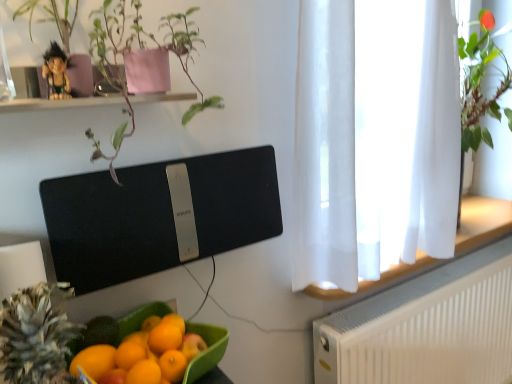
What do you see at coordinates (141, 61) in the screenshot? The height and width of the screenshot is (384, 512). I see `green matte plant at upper left` at bounding box center [141, 61].

What is the approximate width of green matte plant at upper left?

green matte plant at upper left is 9.92 inches wide.

Describe the element at coordinates (159, 215) in the screenshot. I see `black matte speaker at upper center` at that location.

This screenshot has height=384, width=512. In order to click on white sheer curtain at right in this screenshot , I will do `click(374, 138)`.

Describe the element at coordinates (374, 138) in the screenshot. I see `white sheer curtain at right` at that location.

Measure the distance between white textured radiator at lower right and camera.

white textured radiator at lower right is 3.74 feet away from camera.

Measure the distance between point (53,319) and camera.

51.60 centimeters.

What do you see at coordinates (56, 72) in the screenshot?
I see `plastic figurine at upper left` at bounding box center [56, 72].

At what (x,y) coordinates should I click in order to perform the action: click on green matte plant at upper left. Please return your answer as a coordinate pair (x, y). The image size is (512, 384). Looking at the image, I should click on (141, 61).

Could you tell me if white sheer curtain at right is turned towards white textured radiator at lower right?

No, white sheer curtain at right is not oriented towards white textured radiator at lower right.

In the image, is white sheer curtain at right on the left side or the right side of white textured radiator at lower right?

white sheer curtain at right is to the left of white textured radiator at lower right.

The height and width of the screenshot is (384, 512). What are the coordinates of `radiator below the white sheer curtain at right (from the image's perspective)` in the screenshot? It's located at (426, 327).

Does point (326, 236) come in front of point (413, 334)?

Yes, point (326, 236) is in front of point (413, 334).

Is black matte speaker at upper center to the left of green matte plant at upper left from the viewer's perspective?

In fact, black matte speaker at upper center is to the right of green matte plant at upper left.

From a real-world perspective, relative to green matte plant at upper left, is black matte speaker at upper center vertically above or below?

black matte speaker at upper center is situated lower than green matte plant at upper left in the real world.

Based on the photo, would you say black matte speaker at upper center is a long distance from green matte plant at upper left?

No, there isn't a large distance between black matte speaker at upper center and green matte plant at upper left.

Are green textured pineapple at lower left and white sheer curtain at right located far from each other?

No, there isn't a large distance between green textured pineapple at lower left and white sheer curtain at right.

Is green textured pineapple at lower left looking in the opposite direction of white sheer curtain at right?

No, white sheer curtain at right is not at the back of green textured pineapple at lower left.

From the image's perspective, which object appears higher, green textured pineapple at lower left or white sheer curtain at right?

From the image's view, white sheer curtain at right is above.

Is green textured pineapple at lower left wider or thinner than white sheer curtain at right?

Considering their sizes, green textured pineapple at lower left looks slimmer than white sheer curtain at right.

Is white textured radiator at lower right located within black matte speaker at upper center?

No, white textured radiator at lower right is not a part of black matte speaker at upper center.

Does black matte speaker at upper center have a larger size compared to white textured radiator at lower right?

No, black matte speaker at upper center is not bigger than white textured radiator at lower right.

Does point (97, 173) lie behind point (478, 325)?

No.

Which of these two, black matte speaker at upper center or white textured radiator at lower right, stands shorter?

Standing shorter between the two is black matte speaker at upper center.

Is black matte speaker at upper center touching green textured pineapple at lower left?

No, black matte speaker at upper center is not next to green textured pineapple at lower left.

Considering the positions of objects black matte speaker at upper center and green textured pineapple at lower left in the image provided, who is more to the left, black matte speaker at upper center or green textured pineapple at lower left?

green textured pineapple at lower left is more to the left.

Consider the image. Considering the sizes of objects black matte speaker at upper center and green textured pineapple at lower left in the image provided, who is bigger, black matte speaker at upper center or green textured pineapple at lower left?

Bigger between the two is black matte speaker at upper center.

Considering the positions of objects plastic figurine at upper left and white sheer curtain at right in the image provided, who is behind, plastic figurine at upper left or white sheer curtain at right?

white sheer curtain at right is behind.

Based on the photo, which is closer to the camera, (67, 98) or (324, 191)?

The point (67, 98) is closer to the camera.

From the picture: Can you confirm if plastic figurine at upper left is thinner than white sheer curtain at right?

Yes.

Find the location of a particular element. window frame behind the plastic figurine at upper left is located at coordinates (374, 138).

Is green textured pineapple at lower left bigger than black matte speaker at upper center?

No.

Is green textured pineapple at lower left positioned behind black matte speaker at upper center?

No, the depth of green textured pineapple at lower left is less than that of black matte speaker at upper center.

Considering the points (64, 374) and (234, 197), which point is behind, point (64, 374) or point (234, 197)?

The point (234, 197) is more distant.

Is there a large distance between green textured pineapple at lower left and black matte speaker at upper center?

No.

In the image, there is a white sheer curtain at right. Where is `radiator below it (from a real-world perspective)`? This screenshot has height=384, width=512. radiator below it (from a real-world perspective) is located at coordinates (426, 327).

Identify the location of computer monitor below the green matte plant at upper left (from the image's perspective). Image resolution: width=512 pixels, height=384 pixels. (159, 215).

From the image, which object appears to be nearer to black matte speaker at upper center, green matte plant at upper left or plastic figurine at upper left?

green matte plant at upper left is closer to black matte speaker at upper center.

Which object lies nearer to the anchor point white sheer curtain at right, plastic figurine at upper left or black matte speaker at upper center?

black matte speaker at upper center is closer to white sheer curtain at right.

Which object lies further to the anchor point white sheer curtain at right, green matte plant at upper left or black matte speaker at upper center?

green matte plant at upper left is positioned further to the anchor white sheer curtain at right.

Considering their positions, is plastic figurine at upper left positioned closer to black matte speaker at upper center than green matte plant at upper left?

green matte plant at upper left.

From the image, which object appears to be farther from green matte plant at upper left, plastic figurine at upper left or white textured radiator at lower right?

white textured radiator at lower right is further to green matte plant at upper left.

When comparing their distances from plastic figurine at upper left, does white textured radiator at lower right or green textured pineapple at lower left seem further?

white textured radiator at lower right lies further to plastic figurine at upper left than the other object.

When comparing their distances from green textured pineapple at lower left, does black matte speaker at upper center or green matte plant at upper left seem closer?

The object closer to green textured pineapple at lower left is black matte speaker at upper center.

Looking at the image, which one is located further to green matte plant at upper left, black matte speaker at upper center or plastic figurine at upper left?

black matte speaker at upper center lies further to green matte plant at upper left than the other object.

Locate an element on the screen. window frame between black matte speaker at upper center and white textured radiator at lower right from left to right is located at coordinates (374, 138).

Identify the location of computer monitor between green matte plant at upper left and green textured pineapple at lower left vertically. The height and width of the screenshot is (384, 512). (159, 215).

Find the location of `houseplant between plastic figurine at upper left and white sheer curtain at right`. houseplant between plastic figurine at upper left and white sheer curtain at right is located at coordinates click(x=141, y=61).

Where is `window frame between plastic figurine at upper left and white textured radiator at lower right in the horizontal direction`? window frame between plastic figurine at upper left and white textured radiator at lower right in the horizontal direction is located at coordinates (374, 138).